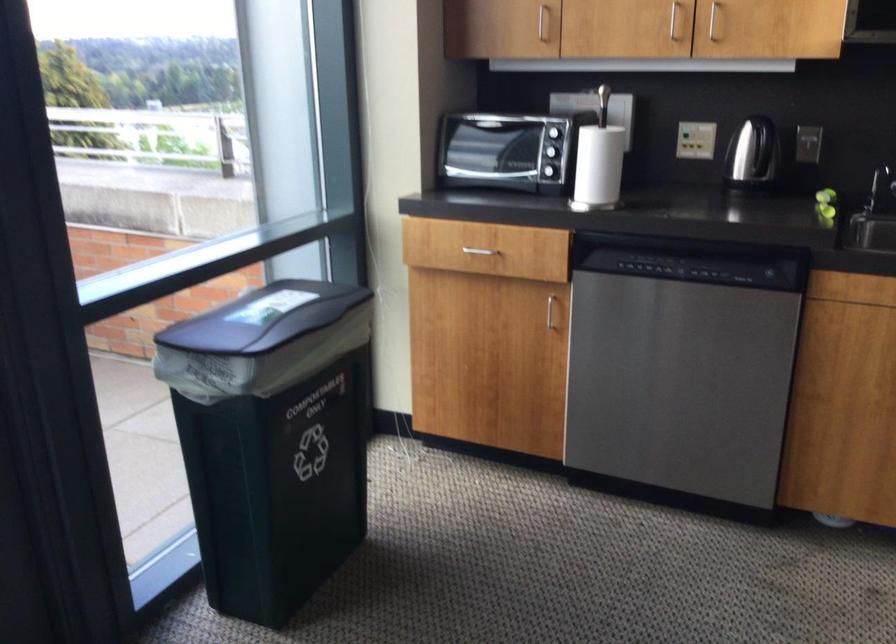
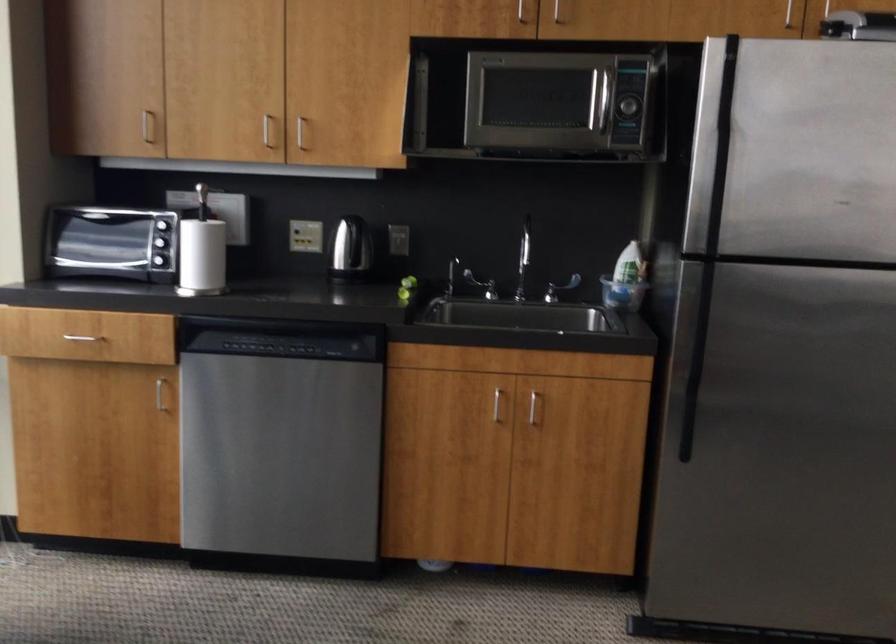
In the second image, find the point that corresponds to point (590, 193) in the first image.

(202, 281)